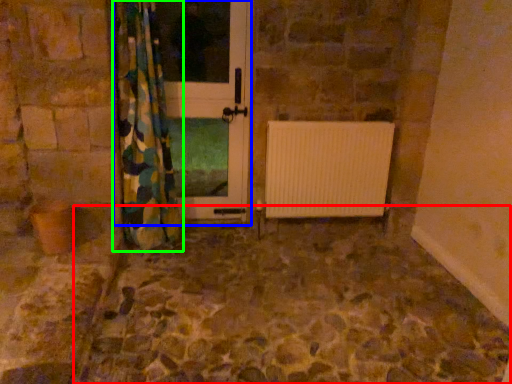
Question: Considering the real-world distances, which object is closest to path (highlighted by a red box)? screen door (highlighted by a blue box) or curtain (highlighted by a green box).

Choices:
 (A) screen door
 (B) curtain

Answer: (B)